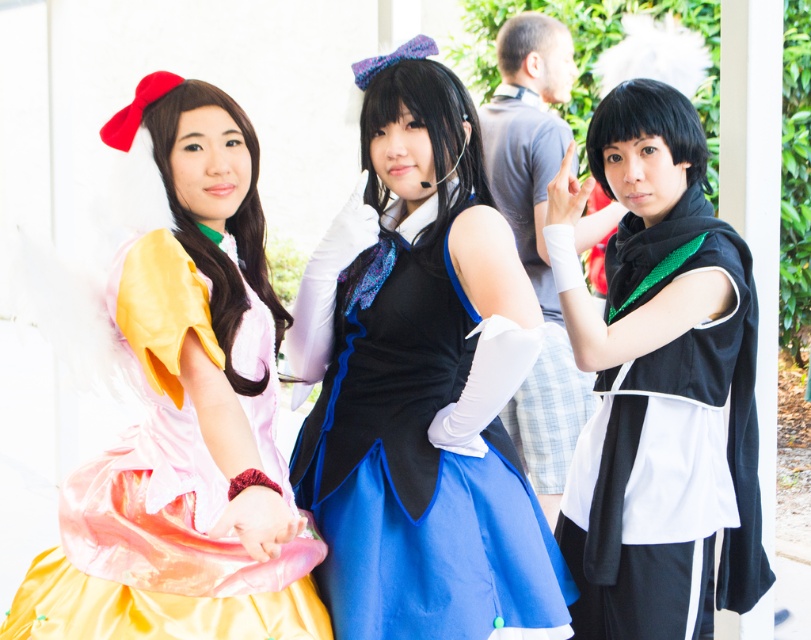
Does satin dress at left have a greater height compared to blue satin dress at center?

Indeed, satin dress at left has a greater height compared to blue satin dress at center.

Is point (73, 307) positioned before point (375, 568)?

Yes, point (73, 307) is in front of point (375, 568).

The width and height of the screenshot is (811, 640). What are the coordinates of `satin dress at left` in the screenshot? It's located at (177, 406).

Is satin dress at left taller than black matte uniform at right?

Incorrect, satin dress at left's height is not larger of black matte uniform at right's.

Does satin dress at left lie in front of black matte uniform at right?

Yes, satin dress at left is closer to the viewer.

Between point (61, 332) and point (749, 326), which one is positioned in front?

Point (61, 332) is in front.

Identify the location of satin dress at left. This screenshot has width=811, height=640. (177, 406).

Is blue satin dress at center taller than black matte uniform at right?

No.

Is blue satin dress at center above black matte uniform at right?

Incorrect, blue satin dress at center is not positioned above black matte uniform at right.

This screenshot has width=811, height=640. What are the coordinates of `blue satin dress at center` in the screenshot? It's located at (417, 448).